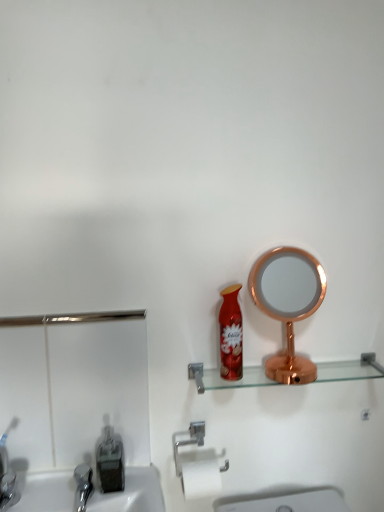
Question: Does silver metallic towel bar at lower center come in front of brushed metal sink at lower left?

Choices:
 (A) no
 (B) yes

Answer: (A)

Question: Is silver metallic towel bar at lower center outside brushed metal sink at lower left?

Choices:
 (A) no
 (B) yes

Answer: (B)

Question: Can you confirm if silver metallic towel bar at lower center is positioned to the left of brushed metal sink at lower left?

Choices:
 (A) yes
 (B) no

Answer: (B)

Question: Could you tell me if silver metallic towel bar at lower center is facing brushed metal sink at lower left?

Choices:
 (A) no
 (B) yes

Answer: (A)

Question: Is brushed metal sink at lower left surrounded by silver metallic towel bar at lower center?

Choices:
 (A) no
 (B) yes

Answer: (A)

Question: Is silver metallic towel bar at lower center next to brushed metal sink at lower left?

Choices:
 (A) no
 (B) yes

Answer: (A)

Question: Does shiny red spray can at center have a greater height compared to copper metallic mirror at right?

Choices:
 (A) no
 (B) yes

Answer: (A)

Question: Is shiny red spray can at center behind copper metallic mirror at right?

Choices:
 (A) no
 (B) yes

Answer: (A)

Question: From the image's perspective, would you say shiny red spray can at center is positioned over copper metallic mirror at right?

Choices:
 (A) no
 (B) yes

Answer: (A)

Question: Considering the relative sizes of shiny red spray can at center and copper metallic mirror at right in the image provided, is shiny red spray can at center shorter than copper metallic mirror at right?

Choices:
 (A) yes
 (B) no

Answer: (A)

Question: Does shiny red spray can at center have a lesser width compared to copper metallic mirror at right?

Choices:
 (A) yes
 (B) no

Answer: (A)

Question: Considering the relative positions of shiny red spray can at center and copper metallic mirror at right in the image provided, is shiny red spray can at center to the left of copper metallic mirror at right from the viewer's perspective?

Choices:
 (A) yes
 (B) no

Answer: (A)

Question: From the image's perspective, would you say transparent glass shelf at center is positioned over brushed metal sink at lower left?

Choices:
 (A) yes
 (B) no

Answer: (A)